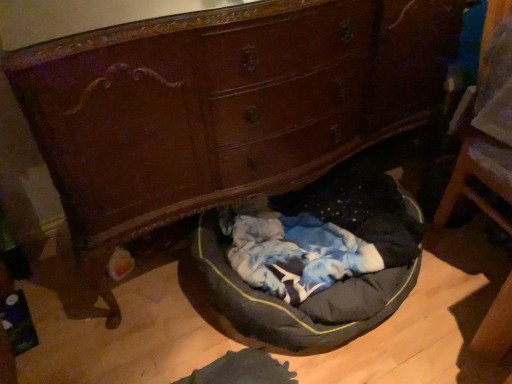
You are a GUI agent. You are given a task and a screenshot of the screen. Output one action in this format:
    pyautogui.click(x=<x>, y=<y>)
    Task: Click on the vacant space that is to the left of black fabric dog bed at center
    This screenshot has width=512, height=384.
    Given the screenshot: What is the action you would take?
    pyautogui.click(x=138, y=321)